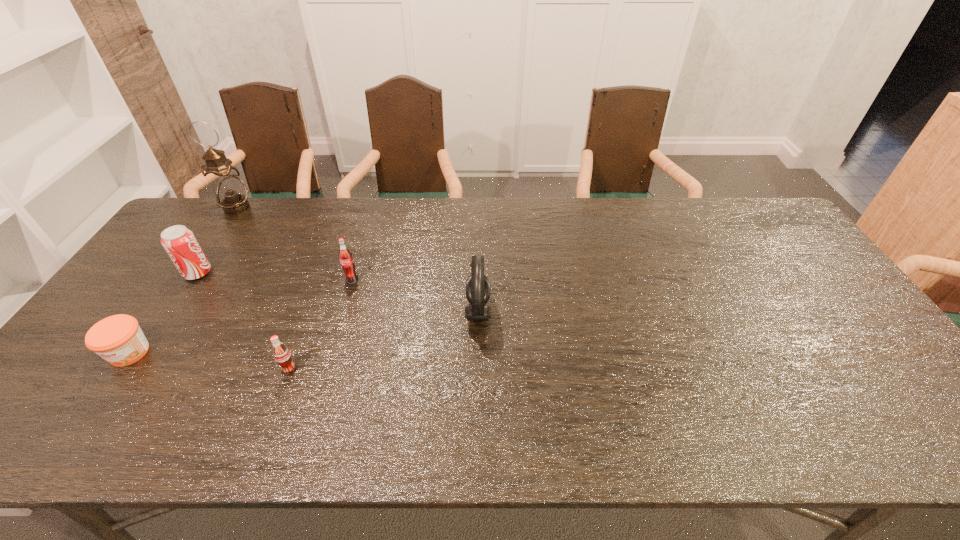
Locate an element on the screen. Image resolution: width=960 pixels, height=540 pixels. oil lamp is located at coordinates (230, 192).

Where is `the farthest object`? the farthest object is located at coordinates (230, 192).

Find the location of `the fourth farthest object`. the fourth farthest object is located at coordinates (478, 288).

The image size is (960, 540). What are the coordinates of `the rightmost object` in the screenshot? It's located at (478, 288).

Find the location of a particular element. the leftmost soda is located at coordinates (179, 242).

You are a GUI agent. You are given a task and a screenshot of the screen. Output one action in this format:
    pyautogui.click(x=<x>, y=<y>)
    Task: Click on the fifth object from left to right
    This screenshot has height=540, width=960.
    Given the screenshot: What is the action you would take?
    pyautogui.click(x=346, y=259)

This screenshot has height=540, width=960. Identify the location of the nearest soda. (282, 355).

Locate an element on the screen. The image size is (960, 540). the second soda from right to left is located at coordinates (282, 355).

Locate an element on the screen. The image size is (960, 540). jam is located at coordinates (118, 339).

Locate an element on the screen. The width and height of the screenshot is (960, 540). free space located 0.250m on the right of the farthest object is located at coordinates (323, 207).